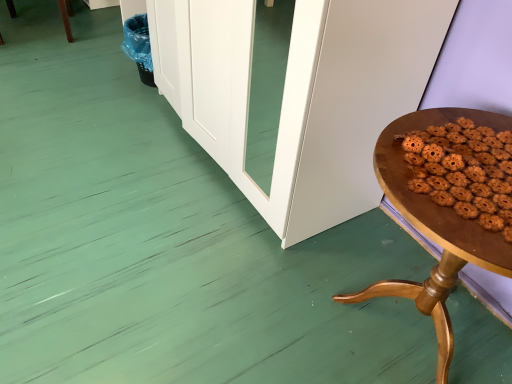
Locate an element on the screen. vacant region under brown matte cookies at right (from a real-world perspective) is located at coordinates (458, 175).